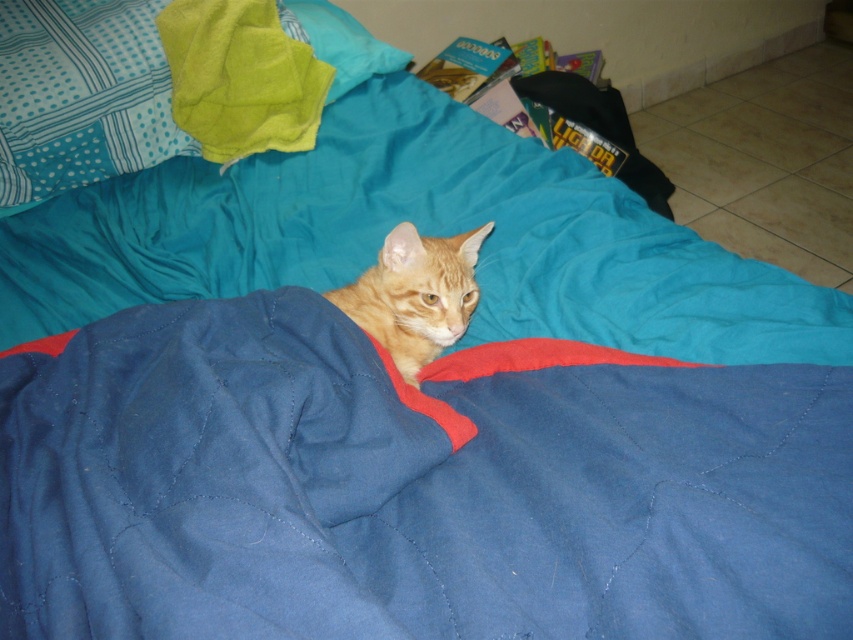
Question: From the image, what is the correct spatial relationship of blue quilted bedsheet at center in relation to orange fur cat at center?

Choices:
 (A) left
 (B) right

Answer: (A)

Question: Where is blue quilted bedsheet at center located in relation to orange fur cat at center in the image?

Choices:
 (A) right
 (B) left

Answer: (B)

Question: Is blue quilted bedsheet at center positioned before orange fur cat at center?

Choices:
 (A) no
 (B) yes

Answer: (B)